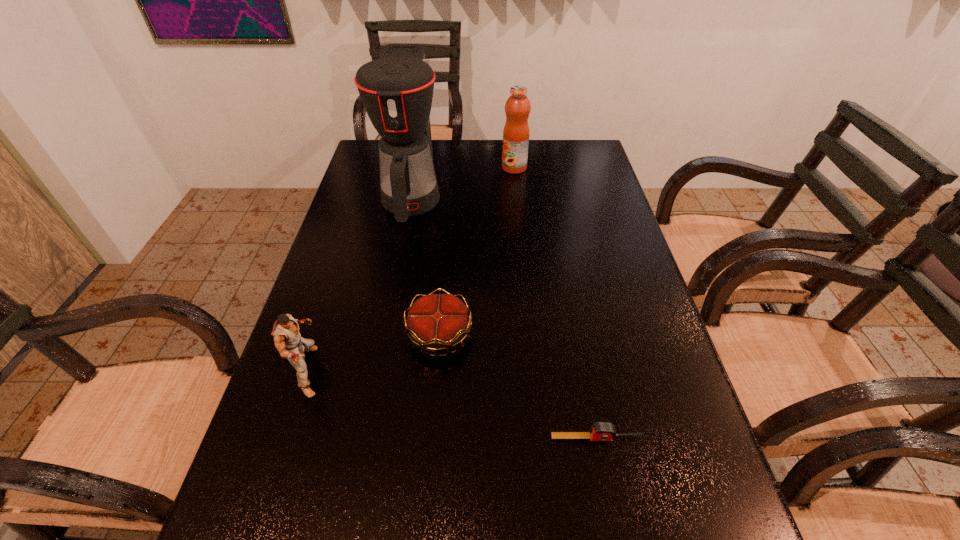
Where is `object that is the nearest to the tape measure`? This screenshot has height=540, width=960. object that is the nearest to the tape measure is located at coordinates (436, 322).

Where is `vacant point that satisfies the following two spatial constraints: 1. on the front label of the nearest object; 2. on the left side of the fruit juice`? This screenshot has width=960, height=540. vacant point that satisfies the following two spatial constraints: 1. on the front label of the nearest object; 2. on the left side of the fruit juice is located at coordinates (542, 438).

Find the location of `free space in the image that satisfies the following two spatial constraints: 1. pour from the carafe of the crown; 2. on the right side of the tallest object`. free space in the image that satisfies the following two spatial constraints: 1. pour from the carafe of the crown; 2. on the right side of the tallest object is located at coordinates (385, 335).

The image size is (960, 540). Identify the location of free location that satisfies the following two spatial constraints: 1. pour from the carafe of the coffee maker; 2. on the left side of the crown. coord(385,335).